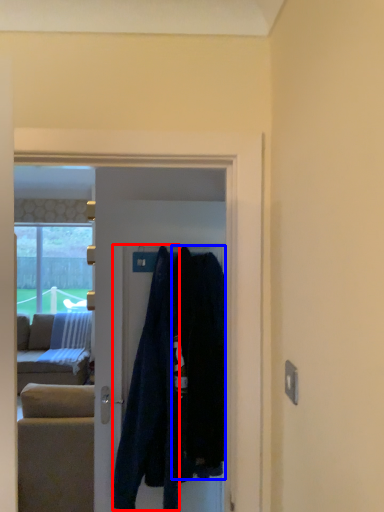
Question: Which of the following is the closest to the observer, clothing (highlighted by a red box) or clothing (highlighted by a blue box)?

Choices:
 (A) clothing
 (B) clothing

Answer: (B)